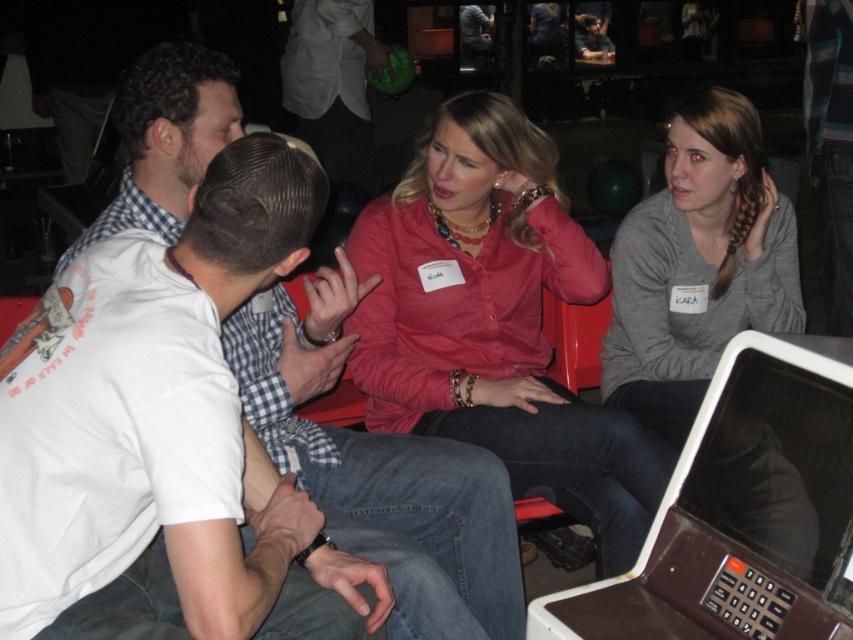
Question: Among these points, which one is nearest to the camera?

Choices:
 (A) (850, 348)
 (B) (401, 512)
 (C) (456, 268)

Answer: (A)

Question: Which object is the closest to the matte pink blouse at center?

Choices:
 (A) white cotton t-shirt at center
 (B) brown plastic laptop at lower right
 (C) gray matte shirt at center

Answer: (A)

Question: Does matte pink blouse at center have a larger size compared to brown plastic laptop at lower right?

Choices:
 (A) yes
 (B) no

Answer: (A)

Question: Can you confirm if white cotton t-shirt at center is bigger than brown plastic laptop at lower right?

Choices:
 (A) no
 (B) yes

Answer: (B)

Question: Which of these objects is positioned farthest from the brown plastic laptop at lower right?

Choices:
 (A) matte pink blouse at center
 (B) gray matte shirt at center
 (C) white cotton t-shirt at center

Answer: (B)

Question: Is matte pink blouse at center closer to the viewer compared to white cotton t-shirt at center?

Choices:
 (A) yes
 (B) no

Answer: (B)